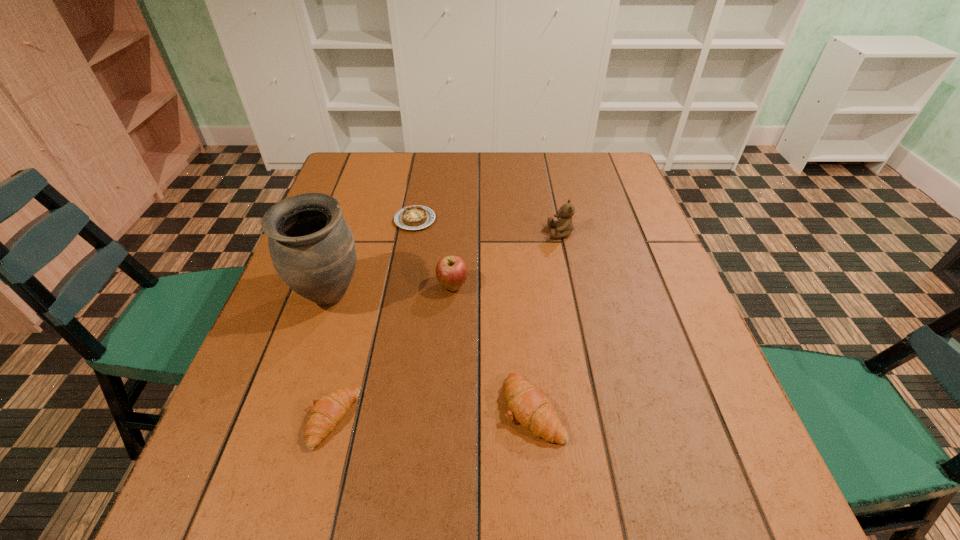
This screenshot has width=960, height=540. Identify the location of free space at the near edge. (575, 433).

This screenshot has width=960, height=540. In the image, there is a desktop. In order to click on vacant region at the left edge in this screenshot , I will do `click(379, 200)`.

Locate an element on the screen. The height and width of the screenshot is (540, 960). vacant space at the right edge of the desktop is located at coordinates (622, 194).

The height and width of the screenshot is (540, 960). In the image, there is a desktop. Find the location of `free space at the far left corner`. free space at the far left corner is located at coordinates (343, 168).

Where is `vacant space at the near left corner of the desktop`? Image resolution: width=960 pixels, height=540 pixels. vacant space at the near left corner of the desktop is located at coordinates (207, 454).

Identify the location of vacant area at the far right corner of the desktop. The height and width of the screenshot is (540, 960). (616, 192).

You are a GUI agent. You are given a task and a screenshot of the screen. Output one action in this format:
    pyautogui.click(x=<x>, y=<y>)
    Task: Click on the blank region between the fourth object from left to right and the quiche
    
    Given the screenshot: What is the action you would take?
    pyautogui.click(x=434, y=253)

The width and height of the screenshot is (960, 540). I want to click on vacant area that lies between the left crescent roll and the third shortest object, so click(x=433, y=414).

Where is `free space between the shortest object and the second object from right to left`? The height and width of the screenshot is (540, 960). free space between the shortest object and the second object from right to left is located at coordinates (474, 314).

Image resolution: width=960 pixels, height=540 pixels. Identify the location of unoccupied area between the taller crescent roll and the fifth tallest object. (433, 414).